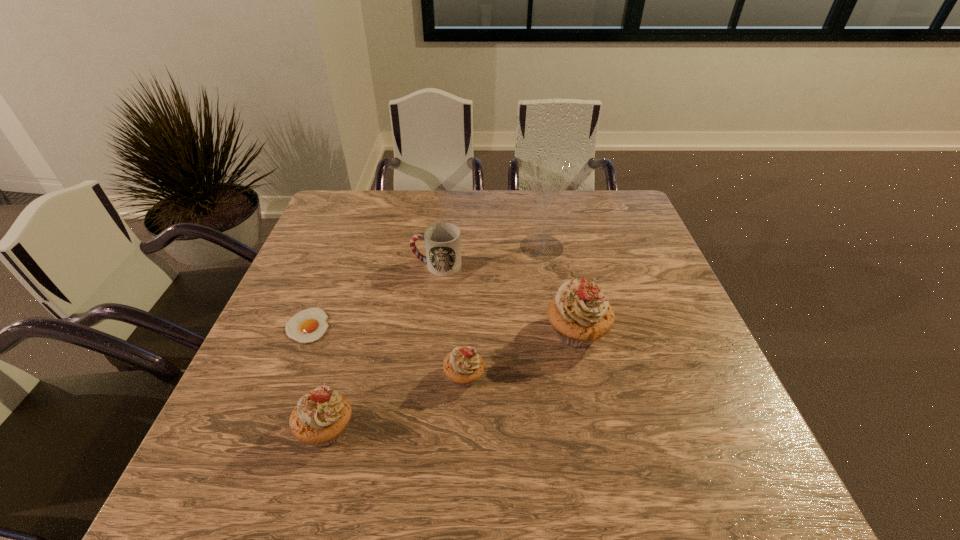
Locate an element on the screen. free spot that satisfies the following two spatial constraints: 1. on the front side of the second object from left to right; 2. on the right side of the shortest object is located at coordinates (266, 429).